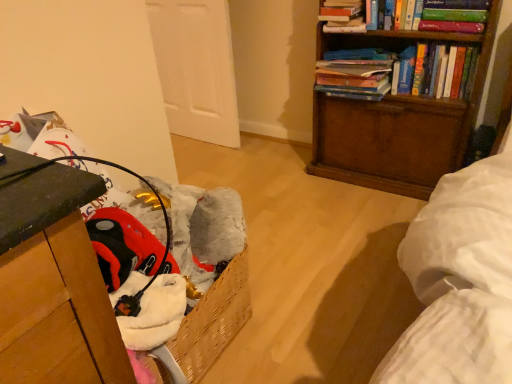
What are the coordinates of `hardcover book at upper right, which is the 1th book from left to right` in the screenshot? It's located at (342, 16).

The image size is (512, 384). In order to click on hardcover books at upper right, the third book from the left in this screenshot , I will do `click(401, 71)`.

Measure the distance between wooden bookcase at upper right and camera.

They are 1.44 meters apart.

Image resolution: width=512 pixels, height=384 pixels. What do you see at coordinates (355, 73) in the screenshot?
I see `hardcover books at upper right, the 2th book from the right` at bounding box center [355, 73].

Where is `hardcover book at upper right, which is the 1th book from left to right`? hardcover book at upper right, which is the 1th book from left to right is located at coordinates (342, 16).

Does hardcover book at upper right, which is the 1th book from left to right, turn towards hardcover books at upper right, the third book from the left?

No, hardcover book at upper right, which is the 1th book from left to right, does not turn towards hardcover books at upper right, the third book from the left.

From the image's perspective, which one is positioned lower, hardcover book at upper right, the 3th book from the right, or hardcover books at upper right, the 1th book when ordered from right to left?

hardcover books at upper right, the 1th book when ordered from right to left, appears lower in the image.

Can you confirm if hardcover book at upper right, which is the 1th book from left to right, is bigger than hardcover books at upper right, the third book from the left?

No, hardcover book at upper right, which is the 1th book from left to right, is not bigger than hardcover books at upper right, the third book from the left.

Is hardcover book at upper right, which is the 1th book from left to right, inside hardcover books at upper right, which ranks as the second book in left-to-right order?

No, hardcover book at upper right, which is the 1th book from left to right, is not inside hardcover books at upper right, which ranks as the second book in left-to-right order.

Can you confirm if hardcover books at upper right, which ranks as the second book in left-to-right order, is shorter than hardcover book at upper right, the 3th book from the right?

Incorrect, the height of hardcover books at upper right, which ranks as the second book in left-to-right order, does not fall short of that of hardcover book at upper right, the 3th book from the right.

Is hardcover books at upper right, which ranks as the second book in left-to-right order, directly adjacent to hardcover book at upper right, which is the 1th book from left to right?

hardcover books at upper right, which ranks as the second book in left-to-right order, and hardcover book at upper right, which is the 1th book from left to right, are clearly separated.

Is hardcover books at upper right, the 2th book from the right, in front of or behind hardcover book at upper right, the 3th book from the right, in the image?

hardcover books at upper right, the 2th book from the right, is positioned closer to the viewer than hardcover book at upper right, the 3th book from the right.

From the image's perspective, is hardcover book at upper right, which is the 1th book from left to right, above wooden bookcase at upper right?

Correct, hardcover book at upper right, which is the 1th book from left to right, appears higher than wooden bookcase at upper right in the image.

Is the position of hardcover book at upper right, the 3th book from the right, more distant than that of wooden bookcase at upper right?

Yes, it is.

Is hardcover book at upper right, the 3th book from the right, positioned with its back to wooden bookcase at upper right?

Absolutely, hardcover book at upper right, the 3th book from the right, is directed away from wooden bookcase at upper right.

Can you confirm if wooden bookcase at upper right is smaller than hardcover book at upper right, the 3th book from the right?

Incorrect, wooden bookcase at upper right is not smaller in size than hardcover book at upper right, the 3th book from the right.

From the image's perspective, is wooden bookcase at upper right under hardcover book at upper right, which is the 1th book from left to right?

Yes, from the image's perspective, wooden bookcase at upper right is below hardcover book at upper right, which is the 1th book from left to right.

Considering the sizes of wooden bookcase at upper right and hardcover book at upper right, the 3th book from the right, in the image, is wooden bookcase at upper right taller or shorter than hardcover book at upper right, the 3th book from the right,?

In the image, wooden bookcase at upper right appears to be taller than hardcover book at upper right, the 3th book from the right.

Is wooden bookcase at upper right to the left of hardcover books at upper right, the third book from the left, from the viewer's perspective?

Yes, wooden bookcase at upper right is to the left of hardcover books at upper right, the third book from the left.

Can hardcover books at upper right, the 1th book when ordered from right to left, be found inside wooden bookcase at upper right?

Yes, hardcover books at upper right, the 1th book when ordered from right to left, is a part of wooden bookcase at upper right.

Which of these two, wooden bookcase at upper right or hardcover books at upper right, the 1th book when ordered from right to left, is thinner?

Thinner between the two is hardcover books at upper right, the 1th book when ordered from right to left.

Can you confirm if hardcover books at upper right, the 2th book from the right, is positioned to the left of hardcover books at upper right, the 1th book when ordered from right to left?

Yes, hardcover books at upper right, the 2th book from the right, is to the left of hardcover books at upper right, the 1th book when ordered from right to left.

From the picture: Is hardcover books at upper right, the 2th book from the right, in front of or behind hardcover books at upper right, the 1th book when ordered from right to left, in the image?

Clearly, hardcover books at upper right, the 2th book from the right, is behind hardcover books at upper right, the 1th book when ordered from right to left.

The width and height of the screenshot is (512, 384). I want to click on the 1st book above the hardcover books at upper right, the 1th book when ordered from right to left (from the image's perspective), so click(355, 73).

Is point (328, 55) in front of point (444, 59)?

No.

This screenshot has height=384, width=512. What are the coordinates of `book that is behind the hardcover books at upper right, the 2th book from the right` in the screenshot? It's located at (342, 16).

Would you say hardcover book at upper right, which is the 1th book from left to right, contains hardcover books at upper right, which ranks as the second book in left-to-right order?

Definitely not — hardcover books at upper right, which ranks as the second book in left-to-right order, is not inside hardcover book at upper right, which is the 1th book from left to right.

Consider the image. Is hardcover books at upper right, which ranks as the second book in left-to-right order, at the back of hardcover book at upper right, which is the 1th book from left to right?

No, hardcover book at upper right, which is the 1th book from left to right, is not facing the opposite direction of hardcover books at upper right, which ranks as the second book in left-to-right order.

Considering the sizes of hardcover book at upper right, the 3th book from the right, and hardcover books at upper right, which ranks as the second book in left-to-right order, in the image, is hardcover book at upper right, the 3th book from the right, wider or thinner than hardcover books at upper right, which ranks as the second book in left-to-right order,?

hardcover book at upper right, the 3th book from the right, is thinner than hardcover books at upper right, which ranks as the second book in left-to-right order.

Where is `the 2nd book above the hardcover books at upper right, the 1th book when ordered from right to left (from the image's perspective)`? the 2nd book above the hardcover books at upper right, the 1th book when ordered from right to left (from the image's perspective) is located at coordinates (342, 16).

At what (x,y) coordinates should I click in order to perform the action: click on book behind the hardcover books at upper right, which ranks as the second book in left-to-right order. Please return your answer as a coordinate pair (x, y). This screenshot has width=512, height=384. Looking at the image, I should click on (342, 16).

Based on their spatial positions, is hardcover book at upper right, the 3th book from the right, or hardcover books at upper right, which ranks as the second book in left-to-right order, further from wooden bookcase at upper right?

hardcover book at upper right, the 3th book from the right, is further to wooden bookcase at upper right.

Looking at the image, which one is located closer to hardcover book at upper right, which is the 1th book from left to right, hardcover books at upper right, the 2th book from the right, or wooden bookcase at upper right?

Based on the image, hardcover books at upper right, the 2th book from the right, appears to be nearer to hardcover book at upper right, which is the 1th book from left to right.

Considering their positions, is hardcover books at upper right, the third book from the left, positioned closer to wooden bookcase at upper right than hardcover books at upper right, which ranks as the second book in left-to-right order?

hardcover books at upper right, the third book from the left, is positioned closer to the anchor wooden bookcase at upper right.

Considering their positions, is hardcover book at upper right, which is the 1th book from left to right, positioned closer to wooden bookcase at upper right than hardcover books at upper right, the third book from the left?

Among the two, hardcover books at upper right, the third book from the left, is located nearer to wooden bookcase at upper right.

Consider the image. Based on their spatial positions, is hardcover book at upper right, which is the 1th book from left to right, or wooden bookcase at upper right further from hardcover books at upper right, the 2th book from the right?

wooden bookcase at upper right is further to hardcover books at upper right, the 2th book from the right.

Looking at the image, which one is located closer to hardcover books at upper right, the 2th book from the right, hardcover books at upper right, the 1th book when ordered from right to left, or hardcover book at upper right, the 3th book from the right?

hardcover books at upper right, the 1th book when ordered from right to left, is closer to hardcover books at upper right, the 2th book from the right.

Looking at the image, which one is located closer to hardcover books at upper right, the 2th book from the right, wooden bookcase at upper right or hardcover books at upper right, the third book from the left?

Among the two, hardcover books at upper right, the third book from the left, is located nearer to hardcover books at upper right, the 2th book from the right.

When comparing their distances from hardcover book at upper right, which is the 1th book from left to right, does hardcover books at upper right, the third book from the left, or hardcover books at upper right, the 2th book from the right, seem further?

hardcover books at upper right, the third book from the left, lies further to hardcover book at upper right, which is the 1th book from left to right, than the other object.

This screenshot has width=512, height=384. I want to click on book located between hardcover book at upper right, the 3th book from the right, and hardcover books at upper right, the 1th book when ordered from right to left, in the left-right direction, so [355, 73].

This screenshot has height=384, width=512. In order to click on bookcase between hardcover books at upper right, the 2th book from the right, and hardcover books at upper right, the third book from the left, in the horizontal direction in this screenshot , I will do `click(396, 121)`.